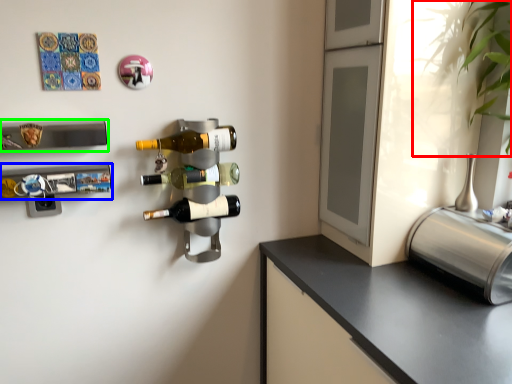
Question: Based on their relative distances, which object is nearer to plant (highlighted by a red box)? Choose from wine rack (highlighted by a blue box) and wine rack (highlighted by a green box).

Choices:
 (A) wine rack
 (B) wine rack

Answer: (B)